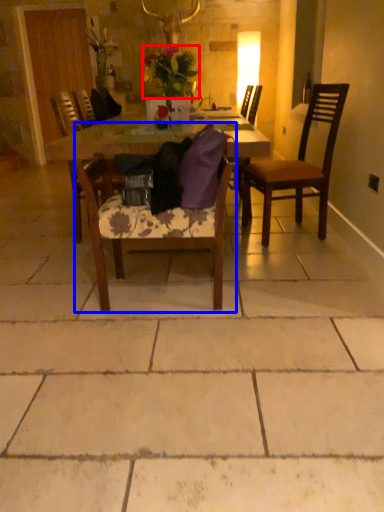
Question: Among these objects, which one is farthest to the camera, flower (highlighted by a red box) or chair (highlighted by a blue box)?

Choices:
 (A) flower
 (B) chair

Answer: (A)